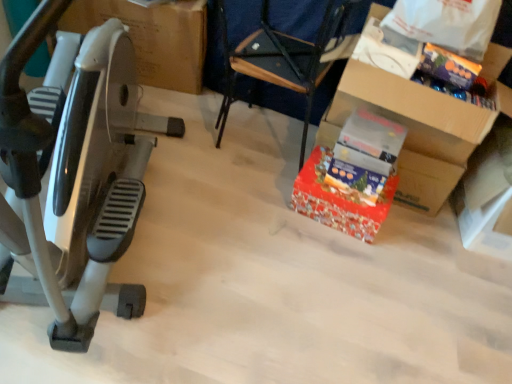
The width and height of the screenshot is (512, 384). What are the coordinates of `vacant space in front of blue fabric armchair at center` in the screenshot? It's located at click(246, 203).